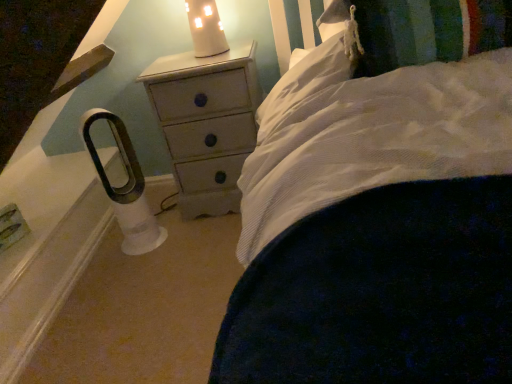
Locate an element on the screen. This screenshot has width=512, height=384. white soft pillow at upper right is located at coordinates (425, 31).

You are a GUI agent. You are given a task and a screenshot of the screen. Output one action in this format:
    pyautogui.click(x=<x>, y=<y>)
    Task: Click on the candle holder that appears on the left of white painted wood chest of drawers at center
    The height and width of the screenshot is (384, 512).
    Given the screenshot: What is the action you would take?
    pyautogui.click(x=206, y=28)

Can you tell me how much white ceramic candle at upper center and white painted wood chest of drawers at center differ in facing direction?

The angle between the facing direction of white ceramic candle at upper center and the facing direction of white painted wood chest of drawers at center is 0.899 degrees.

In the scene shown: Is white painted wood chest of drawers at center at the back of white ceramic candle at upper center?

No, white ceramic candle at upper center is not facing away from white painted wood chest of drawers at center.

Can you confirm if white ceramic candle at upper center is positioned to the right of white painted wood chest of drawers at center?

No.

In the scene shown: Does white ceramic candle at upper center appear on the right side of white soft pillow at upper right?

No, white ceramic candle at upper center is not to the right of white soft pillow at upper right.

How many degrees apart are the facing directions of white ceramic candle at upper center and white soft pillow at upper right?

white ceramic candle at upper center and white soft pillow at upper right are facing 0.156 degrees away from each other.

Based on the photo, from a real-world perspective, which object stands above the other?

white ceramic candle at upper center is physically above.

Which is less distant, (178, 138) or (223, 42)?

The point (178, 138) is closer to the camera.

Which object is thinner, white painted wood chest of drawers at center or white ceramic candle at upper center?

white ceramic candle at upper center.

Is white painted wood chest of drawers at center with white ceramic candle at upper center?

No, white painted wood chest of drawers at center is not with white ceramic candle at upper center.

In terms of height, does white painted wood chest of drawers at center look taller or shorter compared to white ceramic candle at upper center?

Considering their sizes, white painted wood chest of drawers at center has more height than white ceramic candle at upper center.

Looking at this image, what's the angular difference between white soft pillow at upper right and white ceramic candle at upper center's facing directions?

There is a 0.156-degree angle between the facing directions of white soft pillow at upper right and white ceramic candle at upper center.

Is white soft pillow at upper right far away from white ceramic candle at upper center?

No, white soft pillow at upper right is not far away from white ceramic candle at upper center.

Between white soft pillow at upper right and white ceramic candle at upper center, which one has more height?

white ceramic candle at upper center.

Is white soft pillow at upper right behind white ceramic candle at upper center?

No, white soft pillow at upper right is closer to the camera.

From the picture: From a real-world perspective, who is located lower, white soft pillow at upper right or white painted wood chest of drawers at center?

From a 3D spatial view, white painted wood chest of drawers at center is below.

Could you tell me if white soft pillow at upper right is facing white painted wood chest of drawers at center?

No, white soft pillow at upper right is not oriented towards white painted wood chest of drawers at center.

Based on the photo, from the image's perspective, which is above, white soft pillow at upper right or white painted wood chest of drawers at center?

From the image's view, white soft pillow at upper right is above.

Is white soft pillow at upper right far from white painted wood chest of drawers at center?

No.

From a real-world perspective, who is located lower, white painted wood chest of drawers at center or white soft pillow at upper right?

white painted wood chest of drawers at center is physically lower.

Which point is more forward, (x=254, y=120) or (x=403, y=32)?

Positioned in front is point (x=403, y=32).

Is white painted wood chest of drawers at center in front of or behind white soft pillow at upper right in the image?

white painted wood chest of drawers at center is behind white soft pillow at upper right.

Where is `candle holder in front of the white painted wood chest of drawers at center`? candle holder in front of the white painted wood chest of drawers at center is located at coordinates (206, 28).

Locate an element on the screen. The image size is (512, 384). pillow directly beneath the white ceramic candle at upper center (from a real-world perspective) is located at coordinates (425, 31).

Based on their spatial positions, is white soft pillow at upper right or white ceramic candle at upper center closer to white painted wood chest of drawers at center?

white ceramic candle at upper center is positioned closer to the anchor white painted wood chest of drawers at center.

When comparing their distances from white ceramic candle at upper center, does white painted wood chest of drawers at center or white soft pillow at upper right seem further?

white soft pillow at upper right is further to white ceramic candle at upper center.

Which object lies further to the anchor point white ceramic candle at upper center, white soft pillow at upper right or white painted wood chest of drawers at center?

The object further to white ceramic candle at upper center is white soft pillow at upper right.

Considering their positions, is white ceramic candle at upper center positioned closer to white painted wood chest of drawers at center than white soft pillow at upper right?

white ceramic candle at upper center is closer to white painted wood chest of drawers at center.

In the scene shown: Considering their positions, is white ceramic candle at upper center positioned closer to white soft pillow at upper right than white painted wood chest of drawers at center?

white painted wood chest of drawers at center is positioned closer to the anchor white soft pillow at upper right.

Looking at the image, which one is located closer to white soft pillow at upper right, white painted wood chest of drawers at center or white ceramic candle at upper center?

Among the two, white painted wood chest of drawers at center is located nearer to white soft pillow at upper right.

Identify the location of the chest of drawers located between white ceramic candle at upper center and white soft pillow at upper right in the left-right direction. The width and height of the screenshot is (512, 384). (207, 123).